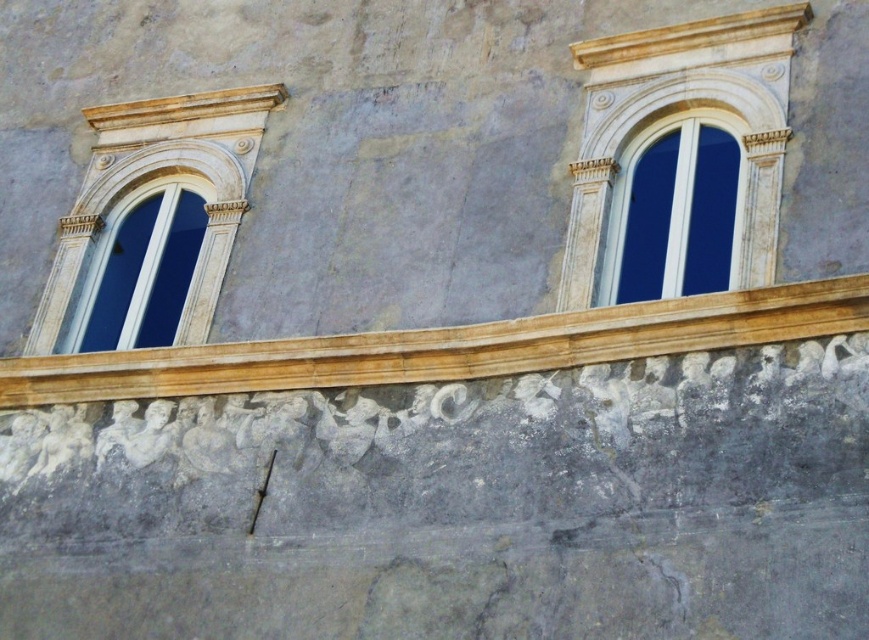
You are standing at point A at the point labeled point (454, 339). You want to walk to point B, which is 154.41 feet away from point A. Can you estimate how many steps it would take if each step is about 2.5 feet?

The distance between point A and point B is 154.41 feet. If each step is approximately 2.5 feet, then dividing 154.41 by 2.5 gives approximately 61.76 steps. Since you can only take whole steps, you would need about 62 steps to cover the distance between point A and point B.

In the scene shown: You are an architect examining the building facade. You need to determine the spatial relationship between the golden stone ledge at center and the matte white window at left. Which object is positioned lower in the scene?

The golden stone ledge at center is located below the matte white window at left, so it is positioned lower in the scene.

You are an architect examining the building facade. You need to install a small decorative plaque that must be placed exactly at the center of the golden stone ledge at center. According to the coordinates provided, where should you position the plaque?

The golden stone ledge at center is located at point (446, 348), so the plaque should be placed at those coordinates to ensure it is centered on the golden stone ledge at center.